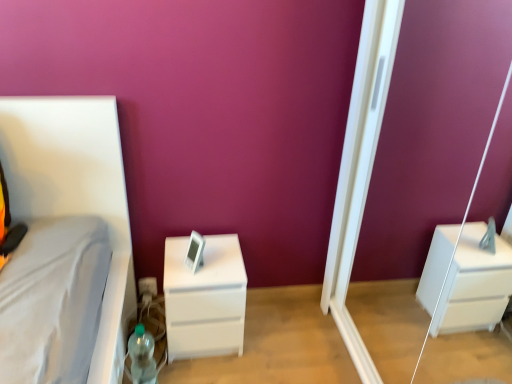
Question: From the image's perspective, relative to translucent plastic bottle at lower left, is white matte chest of drawers at center above or below?

Choices:
 (A) below
 (B) above

Answer: (B)

Question: In terms of size, does white matte chest of drawers at center appear bigger or smaller than translucent plastic bottle at lower left?

Choices:
 (A) small
 (B) big

Answer: (B)

Question: Which of these objects is positioned closest to the white matte chest of drawers at center?

Choices:
 (A) translucent plastic bottle at lower left
 (B) white glossy screen door at right

Answer: (A)

Question: Estimate the real-world distances between objects in this image. Which object is farther from the white glossy screen door at right?

Choices:
 (A) white matte chest of drawers at center
 (B) translucent plastic bottle at lower left

Answer: (B)